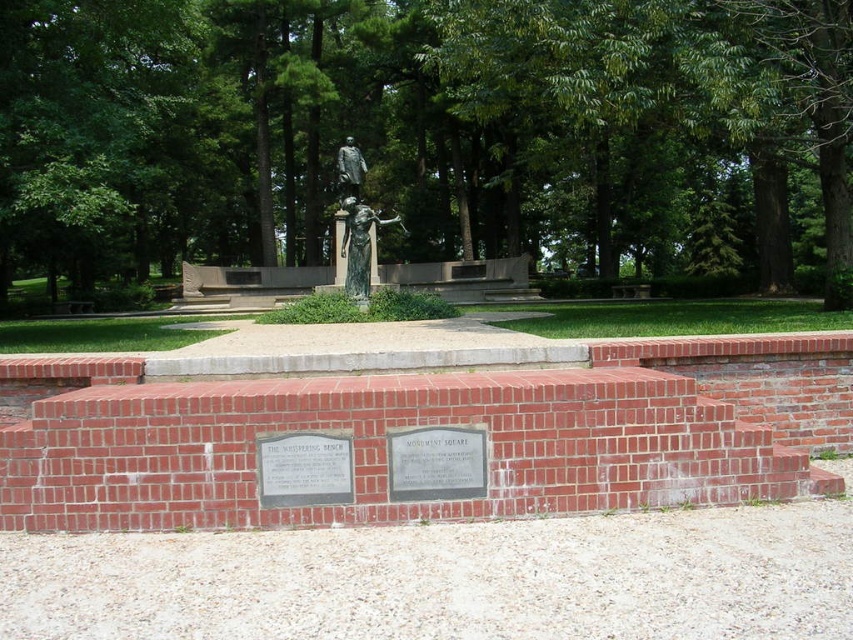
In the scene shown: You are a visitor in the park and want to take a photo of both the green leafy tree at center and the green patina bronze statue at center. Which one should you zoom in on to ensure both are in frame?

Since the green leafy tree at center is larger than the green patina bronze statue at center, you should zoom out to capture both in frame.